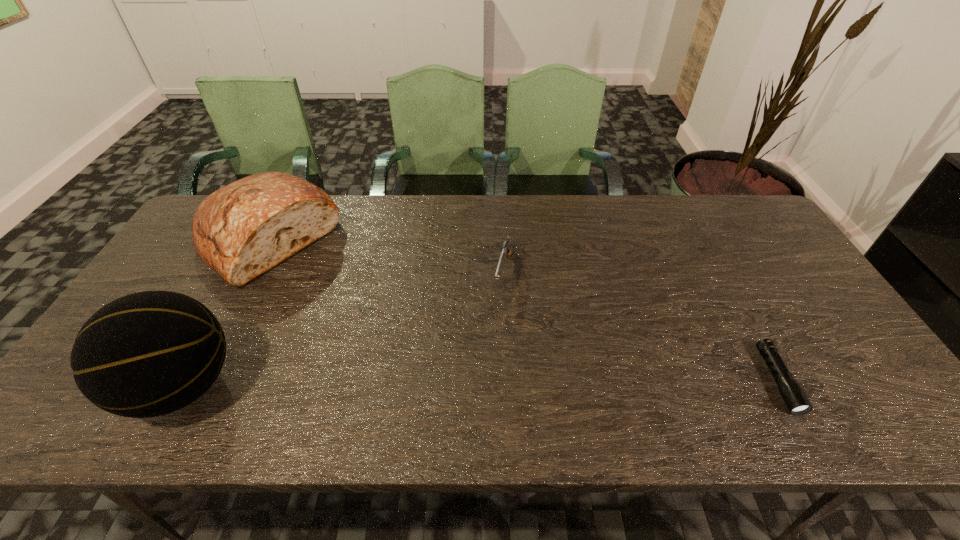
The image size is (960, 540). Find the location of `free spot located aiming along the barrel of the gun`. free spot located aiming along the barrel of the gun is located at coordinates coord(492,339).

I want to click on vacant space located aiming along the barrel of the gun, so click(x=499, y=312).

Where is `vacant space located 0.300m aiming along the barrel of the gun`? vacant space located 0.300m aiming along the barrel of the gun is located at coordinates (477, 394).

This screenshot has width=960, height=540. In order to click on object situated at the far edge in this screenshot , I will do `click(240, 231)`.

Where is `basketball located at the near edge`? The width and height of the screenshot is (960, 540). basketball located at the near edge is located at coordinates (147, 354).

Where is `flashlight that is at the near edge`? flashlight that is at the near edge is located at coordinates (794, 397).

Where is `basketball that is positioned at the left edge`? basketball that is positioned at the left edge is located at coordinates (147, 354).

This screenshot has width=960, height=540. In order to click on bread at the left edge in this screenshot , I will do `click(240, 231)`.

Find the location of a particular element. The width and height of the screenshot is (960, 540). object at the far left corner is located at coordinates (240, 231).

You are a GUI agent. You are given a task and a screenshot of the screen. Output one action in this format:
    pyautogui.click(x=<x>, y=<y>)
    Task: Click on the object that is at the near left corner
    The image size is (960, 540).
    Given the screenshot: What is the action you would take?
    pyautogui.click(x=147, y=354)